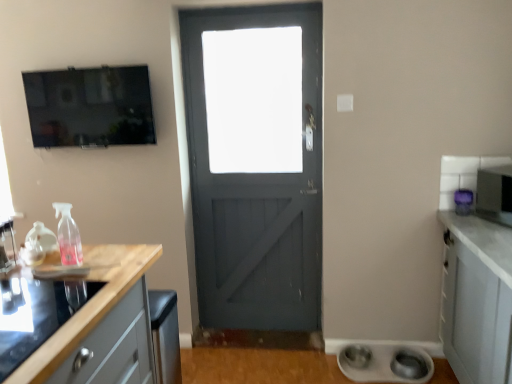
Question: Is wooden at left wider than metallic silver microwave at right, which appears as the 3th appliance when viewed from the left?

Choices:
 (A) yes
 (B) no

Answer: (A)

Question: Is wooden at left at the right side of metallic silver microwave at right, which appears as the 1th appliance when viewed from the top?

Choices:
 (A) no
 (B) yes

Answer: (A)

Question: Does wooden at left have a larger size compared to metallic silver microwave at right, which appears as the 1th appliance when viewed from the top?

Choices:
 (A) yes
 (B) no

Answer: (A)

Question: Is wooden at left at the left side of metallic silver microwave at right, which appears as the 1th appliance when viewed from the right?

Choices:
 (A) no
 (B) yes

Answer: (B)

Question: Is metallic silver microwave at right, which appears as the 1th appliance when viewed from the top, a part of wooden at left?

Choices:
 (A) yes
 (B) no

Answer: (B)

Question: In the image, is matte black tv at upper left positioned in front of or behind metallic silver microwave at right, which appears as the 3th appliance when viewed from the left?

Choices:
 (A) front
 (B) behind

Answer: (B)

Question: Considering the positions of point (72, 92) and point (478, 196), is point (72, 92) closer or farther from the camera than point (478, 196)?

Choices:
 (A) farther
 (B) closer

Answer: (A)

Question: Considering the positions of matte black tv at upper left and metallic silver microwave at right, which appears as the 3th appliance when viewed from the left, in the image, is matte black tv at upper left taller or shorter than metallic silver microwave at right, which appears as the 3th appliance when viewed from the left,?

Choices:
 (A) short
 (B) tall

Answer: (B)

Question: From a real-world perspective, is matte black tv at upper left above or below metallic silver microwave at right, which appears as the 1th appliance when viewed from the top?

Choices:
 (A) below
 (B) above

Answer: (B)

Question: Is point (484, 208) closer or farther from the camera than point (78, 243)?

Choices:
 (A) closer
 (B) farther

Answer: (B)

Question: Is metallic silver microwave at right, which appears as the 3th appliance when viewed from the left, wider or thinner than pink translucent spray bottle at left?

Choices:
 (A) thin
 (B) wide

Answer: (B)

Question: Which is correct: metallic silver microwave at right, which appears as the 1th appliance when viewed from the right, is inside pink translucent spray bottle at left, or outside of it?

Choices:
 (A) outside
 (B) inside

Answer: (A)

Question: In terms of size, does metallic silver microwave at right, which appears as the 1th appliance when viewed from the top, appear bigger or smaller than pink translucent spray bottle at left?

Choices:
 (A) big
 (B) small

Answer: (A)

Question: From their relative heights in the image, would you say white matte bowls at lower right, which is the first appliance from bottom to top, is taller or shorter than matte black tv at upper left?

Choices:
 (A) short
 (B) tall

Answer: (A)

Question: Does point (371, 372) appear closer or farther from the camera than point (45, 107)?

Choices:
 (A) closer
 (B) farther

Answer: (B)